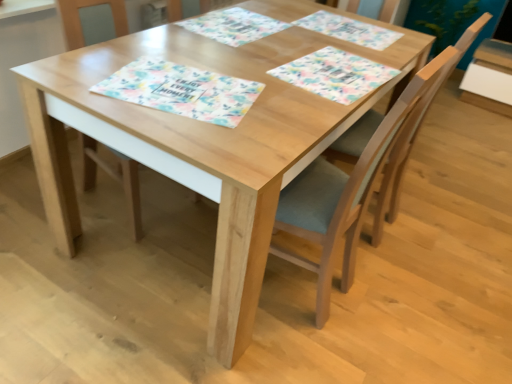
Find the location of a particular element. The image size is (512, 384). light brown wood chair at center, the first chair in the right-to-left sequence is located at coordinates (415, 137).

Image resolution: width=512 pixels, height=384 pixels. What do you see at coordinates (353, 184) in the screenshot? I see `wooden chair at center, which is the second chair from left to right` at bounding box center [353, 184].

Describe the element at coordinates (233, 26) in the screenshot. I see `floral paper placemat at upper center, the third place mat in the front-to-back sequence` at that location.

This screenshot has height=384, width=512. What are the coordinates of `light brown wood chair at center, the first chair in the right-to-left sequence` in the screenshot? It's located at (415, 137).

From a real-world perspective, is floral paper placemat at center, which is the 4th place mat in back-to-front order, physically located above or below light brown wood chair at center, the first chair in the right-to-left sequence?

floral paper placemat at center, which is the 4th place mat in back-to-front order, is situated higher than light brown wood chair at center, the first chair in the right-to-left sequence, in the real world.

How distant is floral paper placemat at center, which is the 4th place mat in back-to-front order, from light brown wood chair at center, the first chair in the right-to-left sequence?

floral paper placemat at center, which is the 4th place mat in back-to-front order, is 27.44 inches from light brown wood chair at center, the first chair in the right-to-left sequence.

Considering the relative sizes of floral paper placemat at center, the first place mat viewed from the front, and light brown wood chair at center, the first chair in the right-to-left sequence, in the image provided, is floral paper placemat at center, the first place mat viewed from the front, shorter than light brown wood chair at center, the first chair in the right-to-left sequence,?

Yes, floral paper placemat at center, the first place mat viewed from the front, is shorter than light brown wood chair at center, the first chair in the right-to-left sequence.

Who is bigger, floral paper placemat at center, which is the 4th place mat in back-to-front order, or light brown wood chair at center, the third chair positioned from the left?

light brown wood chair at center, the third chair positioned from the left.

Is floral paper placemat at center, which is the 3th place mat from back to front, aimed at wooden chair at center, which is the third chair in right-to-left order?

No, floral paper placemat at center, which is the 3th place mat from back to front, does not turn towards wooden chair at center, which is the third chair in right-to-left order.

From a real-world perspective, which object stands above the other?

From a 3D spatial view, floral paper placemat at center, which is the 3th place mat from back to front, is above.

Are floral paper placemat at center, acting as the 2th place mat starting from the front, and wooden chair at center, the first chair from the left, far apart?

That's not correct — floral paper placemat at center, acting as the 2th place mat starting from the front, is a little close to wooden chair at center, the first chair from the left.

Which object is closer to the camera, floral paper placemat at center, acting as the 2th place mat starting from the front, or wooden chair at center, the first chair from the left?

wooden chair at center, the first chair from the left, is in front.

Is point (325, 318) less distant than point (354, 82)?

No, it is behind (354, 82).

Measure the distance from wooden chair at center, which is the second chair from left to right, to floral paper placemat at center, acting as the 2th place mat starting from the front.

A distance of 33.49 centimeters exists between wooden chair at center, which is the second chair from left to right, and floral paper placemat at center, acting as the 2th place mat starting from the front.

Who is taller, wooden chair at center, which is the second chair from left to right, or floral paper placemat at center, which is the 3th place mat from back to front?

With more height is wooden chair at center, which is the second chair from left to right.

Is wooden chair at center, which is the second chair from left to right, to the left or to the right of floral paper placemat at center, which is the 3th place mat from back to front, in the image?

Clearly, wooden chair at center, which is the second chair from left to right, is on the left of floral paper placemat at center, which is the 3th place mat from back to front, in the image.

Would you consider light brown wood chair at center, the first chair in the right-to-left sequence, to be distant from floral paper placemat at center, the first place mat viewed from the front?

light brown wood chair at center, the first chair in the right-to-left sequence, is near floral paper placemat at center, the first place mat viewed from the front, not far away.

Which object is further away from the camera taking this photo, light brown wood chair at center, the third chair positioned from the left, or floral paper placemat at center, the first place mat viewed from the front?

light brown wood chair at center, the third chair positioned from the left, is further from the camera.

Is floral paper placemat at center, the first place mat viewed from the front, at the back of light brown wood chair at center, the first chair in the right-to-left sequence?

light brown wood chair at center, the first chair in the right-to-left sequence, does not have its back to floral paper placemat at center, the first place mat viewed from the front.

What are the coordinates of `place mat in front of the light brown wood chair at center, the first chair in the right-to-left sequence` in the screenshot? It's located at (182, 91).

Considering the relative positions of wooden chair at center, which is the second chair from left to right, and floral paper placemat at center, which is the 4th place mat in back-to-front order, in the image provided, is wooden chair at center, which is the second chair from left to right, to the right of floral paper placemat at center, which is the 4th place mat in back-to-front order, from the viewer's perspective?

Yes.

Which is behind, wooden chair at center, placed as the second chair when sorted from right to left, or floral paper placemat at center, the first place mat viewed from the front?

floral paper placemat at center, the first place mat viewed from the front, is further from the camera.

From a real-world perspective, is wooden chair at center, placed as the second chair when sorted from right to left, positioned above or below floral paper placemat at center, which is the 4th place mat in back-to-front order?

From a real-world perspective, wooden chair at center, placed as the second chair when sorted from right to left, is physically below floral paper placemat at center, which is the 4th place mat in back-to-front order.

Which of these two, wooden chair at center, placed as the second chair when sorted from right to left, or floral paper placemat at center, the first place mat viewed from the front, stands taller?

With more height is wooden chair at center, placed as the second chair when sorted from right to left.

Does point (131, 170) come farther from viewer compared to point (310, 24)?

That is False.

Could you tell me if wooden chair at center, the first chair from the left, is turned towards floral paper placemat at upper center, marked as the 1th place mat in a back-to-front arrangement?

No.

Considering the sizes of objects wooden chair at center, which is the third chair in right-to-left order, and floral paper placemat at upper center, marked as the 1th place mat in a back-to-front arrangement, in the image provided, who is smaller, wooden chair at center, which is the third chair in right-to-left order, or floral paper placemat at upper center, marked as the 1th place mat in a back-to-front arrangement,?

With smaller size is floral paper placemat at upper center, marked as the 1th place mat in a back-to-front arrangement.

Can you see wooden chair at center, which is the third chair in right-to-left order, touching floral paper placemat at upper center, marked as the 1th place mat in a back-to-front arrangement?

wooden chair at center, which is the third chair in right-to-left order, is not next to floral paper placemat at upper center, marked as the 1th place mat in a back-to-front arrangement, and they're not touching.

Is point (225, 14) less distant than point (400, 185)?

That is True.

Is the depth of floral paper placemat at upper center, the 2th place mat viewed from the back, greater than that of light brown wood chair at center, the third chair positioned from the left?

Yes, it is.

Can you confirm if floral paper placemat at upper center, the third place mat in the front-to-back sequence, is smaller than light brown wood chair at center, the first chair in the right-to-left sequence?

Indeed, floral paper placemat at upper center, the third place mat in the front-to-back sequence, has a smaller size compared to light brown wood chair at center, the first chair in the right-to-left sequence.

Is floral paper placemat at upper center, the third place mat in the front-to-back sequence, far from light brown wood chair at center, the third chair positioned from the left?

That's not correct — floral paper placemat at upper center, the third place mat in the front-to-back sequence, is a little close to light brown wood chair at center, the third chair positioned from the left.

Image resolution: width=512 pixels, height=384 pixels. There is a floral paper placemat at center, which is the 4th place mat in back-to-front order. In order to click on the 2nd chair below it (from a real-world perspective) in this screenshot , I will do `click(415, 137)`.

Find the location of a particular element. This screenshot has width=512, height=384. the 1st place mat behind when counting from the wooden chair at center, the first chair from the left is located at coordinates (335, 74).

When comparing their distances from light brown wood chair at center, the first chair in the right-to-left sequence, does wooden chair at center, placed as the second chair when sorted from right to left, or floral paper placemat at upper center, the 2th place mat viewed from the back, seem further?

Among the two, floral paper placemat at upper center, the 2th place mat viewed from the back, is located further to light brown wood chair at center, the first chair in the right-to-left sequence.

Looking at the image, which one is located further to floral paper placemat at center, which is the 3th place mat from back to front, light brown wood chair at center, the first chair in the right-to-left sequence, or floral paper placemat at upper center, the 2th place mat viewed from the back?

floral paper placemat at upper center, the 2th place mat viewed from the back.

When comparing their distances from floral paper placemat at center, acting as the 2th place mat starting from the front, does floral paper placemat at upper center, marked as the 1th place mat in a back-to-front arrangement, or floral paper placemat at upper center, the third place mat in the front-to-back sequence, seem closer?

Among the two, floral paper placemat at upper center, marked as the 1th place mat in a back-to-front arrangement, is located nearer to floral paper placemat at center, acting as the 2th place mat starting from the front.

In the scene shown: Estimate the real-world distances between objects in this image. Which object is further from floral paper placemat at upper center, marked as the 1th place mat in a back-to-front arrangement, floral paper placemat at upper center, the 2th place mat viewed from the back, or floral paper placemat at center, which is the 4th place mat in back-to-front order?

floral paper placemat at center, which is the 4th place mat in back-to-front order, lies further to floral paper placemat at upper center, marked as the 1th place mat in a back-to-front arrangement, than the other object.

When comparing their distances from wooden chair at center, which is the third chair in right-to-left order, does floral paper placemat at center, the first place mat viewed from the front, or light brown wood chair at center, the first chair in the right-to-left sequence, seem closer?

Among the two, floral paper placemat at center, the first place mat viewed from the front, is located nearer to wooden chair at center, which is the third chair in right-to-left order.

Based on the photo, based on their spatial positions, is wooden chair at center, the first chair from the left, or floral paper placemat at upper center, marked as the 1th place mat in a back-to-front arrangement, further from wooden chair at center, placed as the second chair when sorted from right to left?

wooden chair at center, the first chair from the left, lies further to wooden chair at center, placed as the second chair when sorted from right to left, than the other object.

Looking at the image, which one is located closer to floral paper placemat at center, the first place mat viewed from the front, wooden chair at center, the first chair from the left, or wooden chair at center, placed as the second chair when sorted from right to left?

wooden chair at center, placed as the second chair when sorted from right to left, is closer to floral paper placemat at center, the first place mat viewed from the front.

Looking at this image, estimate the real-world distances between objects in this image. Which object is further from floral paper placemat at upper center, the 2th place mat viewed from the back, floral paper placemat at center, acting as the 2th place mat starting from the front, or floral paper placemat at upper center, which is counted as the 4th place mat, starting from the front?

floral paper placemat at center, acting as the 2th place mat starting from the front, lies further to floral paper placemat at upper center, the 2th place mat viewed from the back, than the other object.

Locate an element on the screen. Image resolution: width=512 pixels, height=384 pixels. chair between wooden chair at center, which is the third chair in right-to-left order, and floral paper placemat at upper center, which is counted as the 4th place mat, starting from the front is located at coordinates (353, 184).

I want to click on chair located between floral paper placemat at center, which is the 4th place mat in back-to-front order, and light brown wood chair at center, the first chair in the right-to-left sequence, in the left-right direction, so click(353, 184).

This screenshot has width=512, height=384. Find the location of `chair situated between wooden chair at center, the first chair from the left, and floral paper placemat at center, which is the 3th place mat from back to front, from left to right`. chair situated between wooden chair at center, the first chair from the left, and floral paper placemat at center, which is the 3th place mat from back to front, from left to right is located at coordinates (353, 184).

At what (x,y) coordinates should I click in order to perform the action: click on chair situated between wooden chair at center, the first chair from the left, and light brown wood chair at center, the first chair in the right-to-left sequence, from left to right. Please return your answer as a coordinate pair (x, y). The width and height of the screenshot is (512, 384). Looking at the image, I should click on (353, 184).